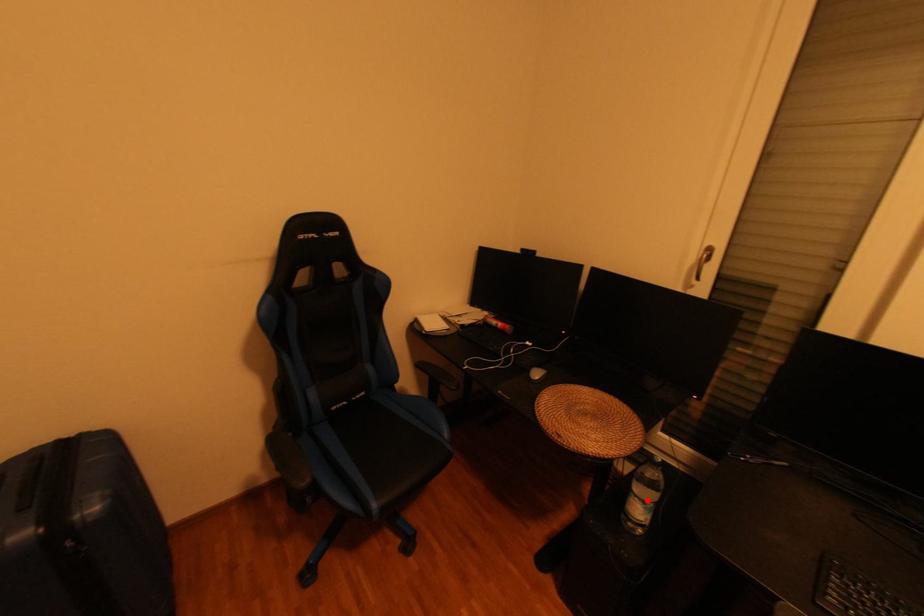
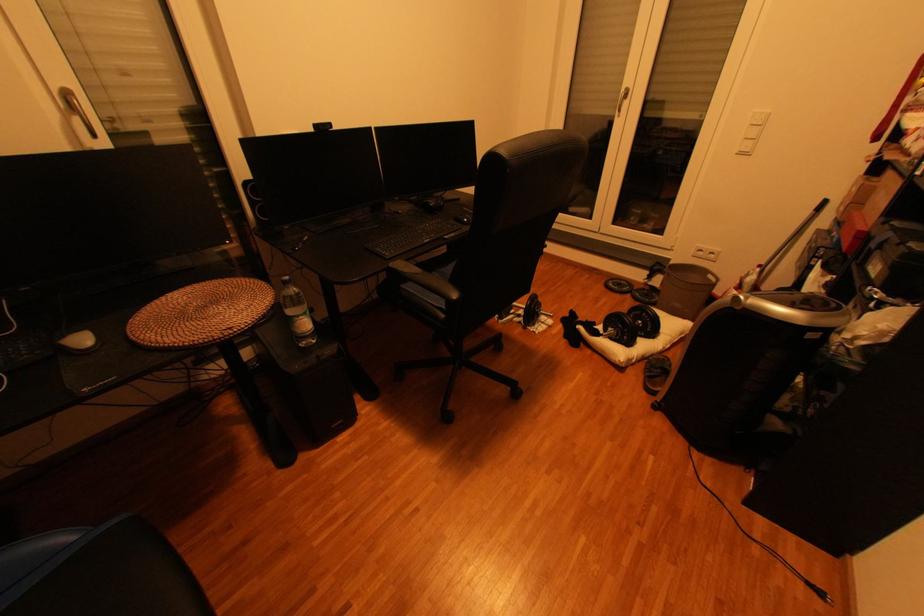
Question: I am providing you with two images of the same scene from different viewpoints. A red point is shown in image1. For the corresponding object point in image2, is it positioned nearer or farther from the camera?

Choices:
 (A) Nearer
 (B) Farther

Answer: (A)